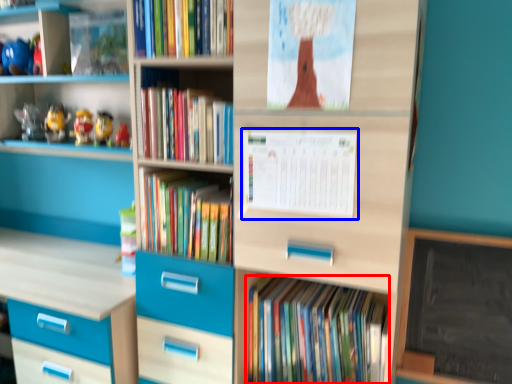
Question: Which object appears farthest to the camera in this image, book (highlighted by a red box) or paperback book (highlighted by a blue box)?

Choices:
 (A) book
 (B) paperback book

Answer: (A)